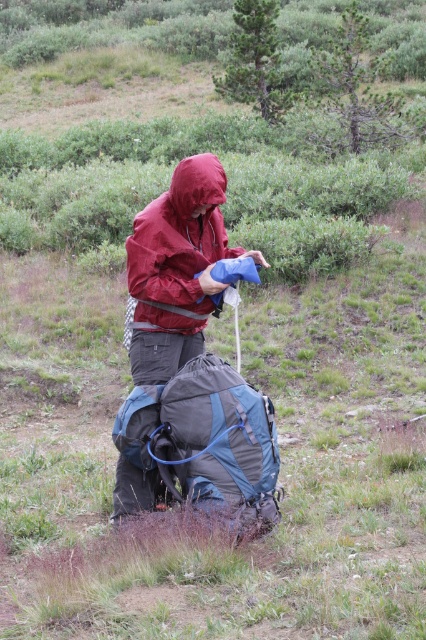
You are packing your gear and need to place the waterproof nylon jacket at center and the matte red jacket at center into a storage compartment. Which jacket should you move first to ensure proper placement?

You should move the waterproof nylon jacket at center first because it is positioned to the left of the matte red jacket at center, so placing it first will allow the matte red jacket at center to be placed to its right as required.

You are packing for a hiking trip and need to fit both the dark gray fabric backpack at center and the waterproof nylon jacket at center into your car trunk. Based on their sizes, which item will require more horizontal space in the trunk?

The dark gray fabric backpack at center requires more horizontal space in the trunk because its width surpasses that of the waterproof nylon jacket at center.